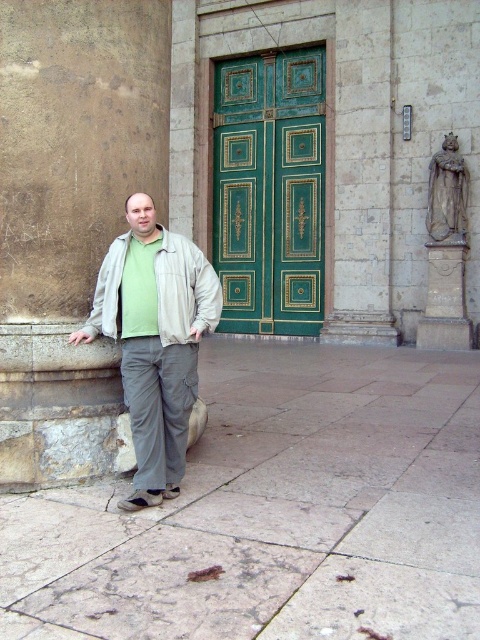
This screenshot has height=640, width=480. What do you see at coordinates (269, 189) in the screenshot? I see `green polished wood door at center` at bounding box center [269, 189].

Is point (274, 298) positioned in front of point (152, 212)?

That is False.

Does point (271, 113) come closer to viewer compared to point (180, 252)?

No, it is not.

You are a GUI agent. You are given a task and a screenshot of the screen. Output one action in this format:
    pyautogui.click(x=<x>, y=<y>)
    Task: Click on the green polished wood door at center
    This screenshot has width=480, height=640.
    Given the screenshot: What is the action you would take?
    pyautogui.click(x=269, y=189)

Is point (282, 392) positioned in front of point (180, 259)?

No, (282, 392) is behind (180, 259).

Is gray stone pavement at lower center positioned in front of beige fabric jacket at center?

That is True.

The image size is (480, 640). In order to click on gray stone pavement at lower center in this screenshot , I will do `click(276, 512)`.

The width and height of the screenshot is (480, 640). In order to click on gray stone pavement at lower center in this screenshot , I will do `click(276, 512)`.

Based on the photo, does gray stone pavement at lower center appear on the right side of light gray cotton pants at center?

Indeed, gray stone pavement at lower center is positioned on the right side of light gray cotton pants at center.

Can you confirm if gray stone pavement at lower center is positioned above light gray cotton pants at center?

No, gray stone pavement at lower center is not above light gray cotton pants at center.

The height and width of the screenshot is (640, 480). I want to click on gray stone pavement at lower center, so click(x=276, y=512).

This screenshot has height=640, width=480. I want to click on gray stone pavement at lower center, so click(x=276, y=512).